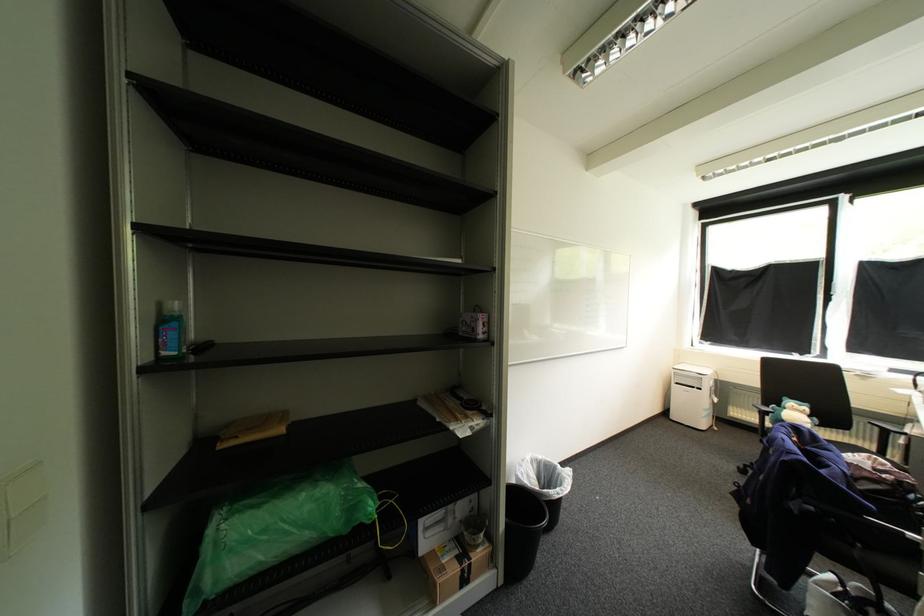
The location [447,516] corresponds to which object?

This point indicates the small cardboard box.